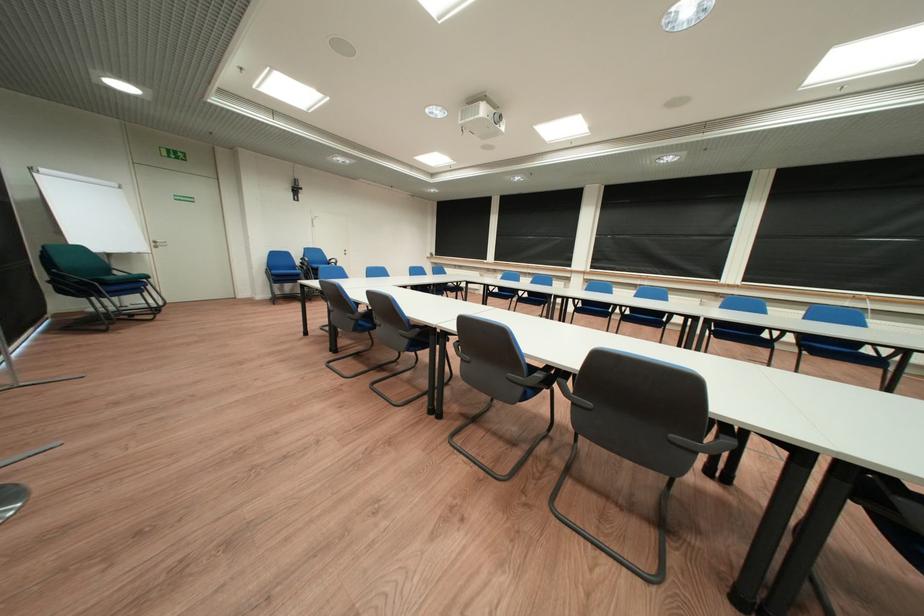
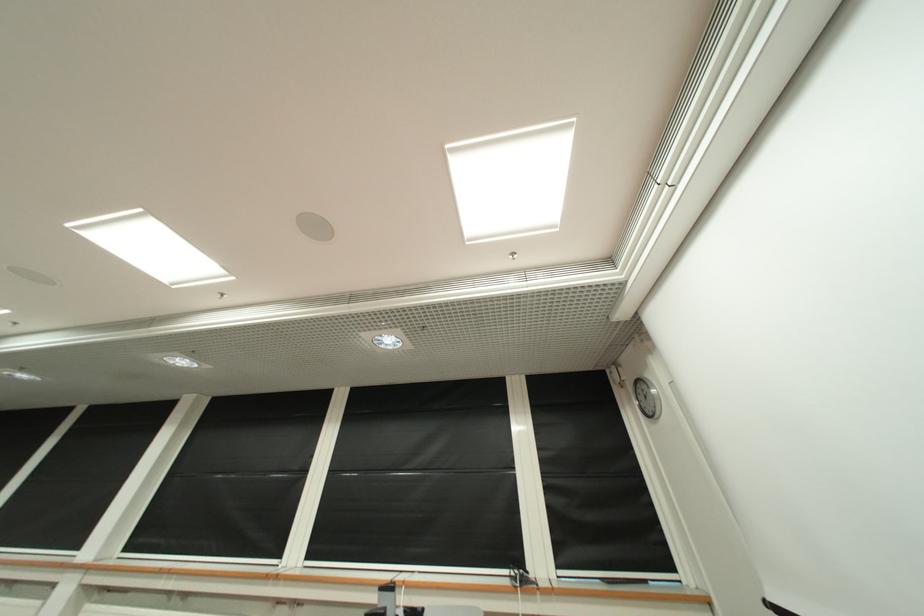
Locate, in the second image, the point that corresponds to point 612,190 in the first image.

(210, 402)